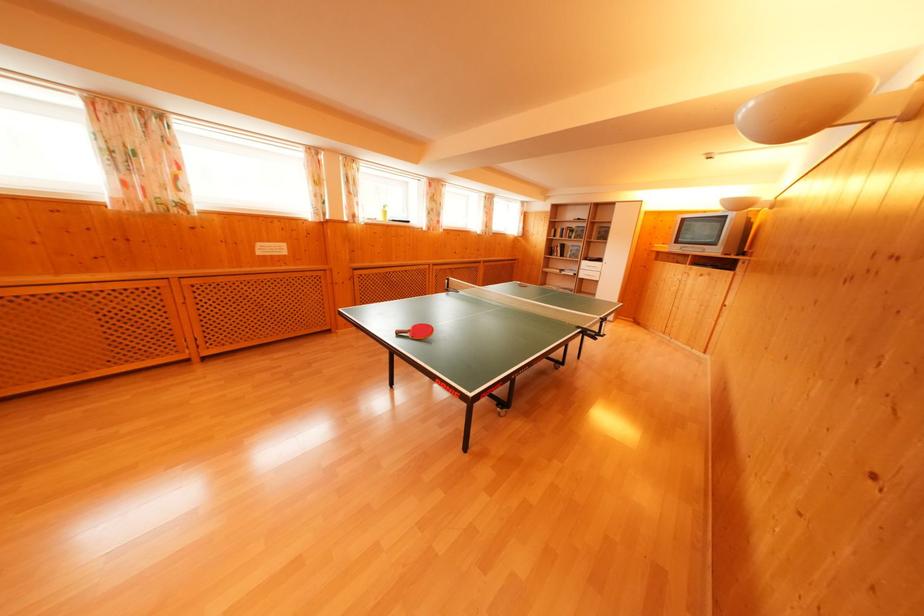
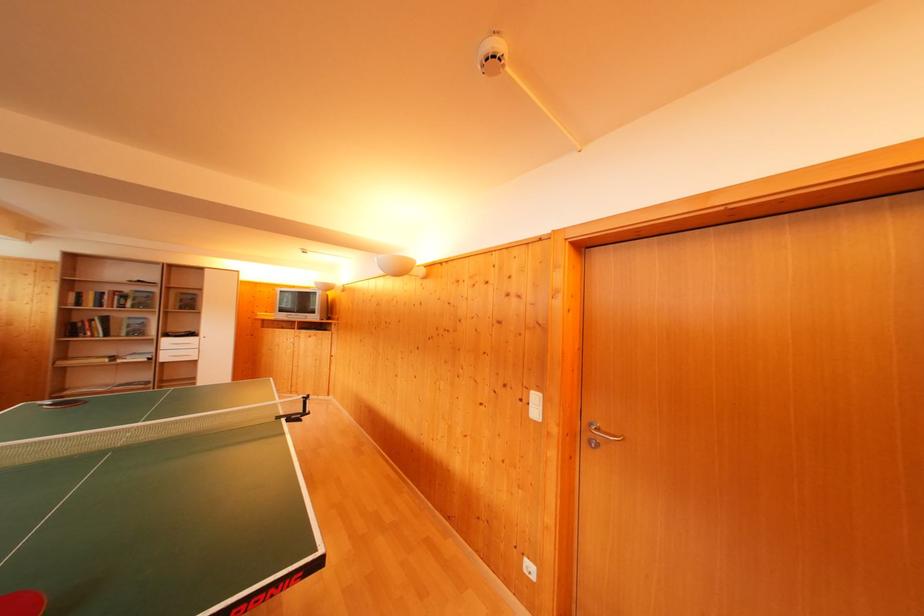
Locate, in the second image, the point that corresponds to (578,257) in the first image.

(140, 331)